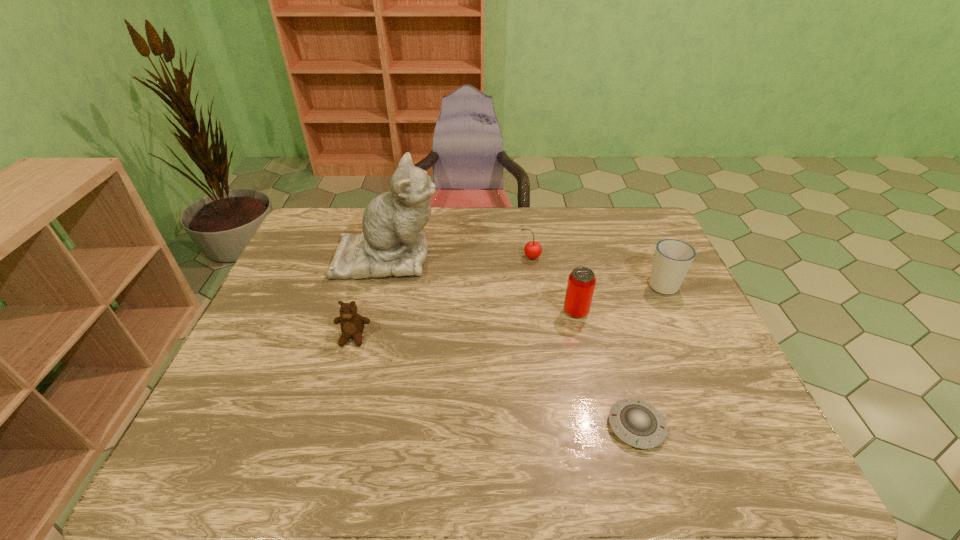
Locate an element on the screen. vacant space at the far edge of the desktop is located at coordinates (433, 211).

At what (x,y) coordinates should I click in order to perform the action: click on free space at the near edge of the desktop. Please return your answer as a coordinate pair (x, y). Looking at the image, I should click on (564, 474).

In the image, there is a desktop. Where is `vacant space at the left edge`? The image size is (960, 540). vacant space at the left edge is located at coordinates (285, 275).

You are a GUI agent. You are given a task and a screenshot of the screen. Output one action in this format:
    pyautogui.click(x=<x>, y=<y>)
    Task: Click on the vacant space at the right edge of the desktop
    Image resolution: width=960 pixels, height=540 pixels.
    Given the screenshot: What is the action you would take?
    pyautogui.click(x=699, y=371)

At what (x,y) coordinates should I click in order to perform the action: click on vacant space at the far left corner of the desktop. Please return your answer as a coordinate pair (x, y). This screenshot has height=540, width=960. Looking at the image, I should click on (344, 218).

Locate an element on the screen. free space at the far right corner of the desktop is located at coordinates (615, 233).

The image size is (960, 540). Identify the location of vacant point at the near right corner. (755, 465).

The width and height of the screenshot is (960, 540). I want to click on vacant point located between the fourth farthest object and the fifth farthest object, so click(465, 325).

Image resolution: width=960 pixels, height=540 pixels. I want to click on free spot between the fourth farthest object and the tallest object, so click(x=482, y=284).

Where is `vacant point located between the can and the cup`? vacant point located between the can and the cup is located at coordinates pyautogui.click(x=619, y=298).